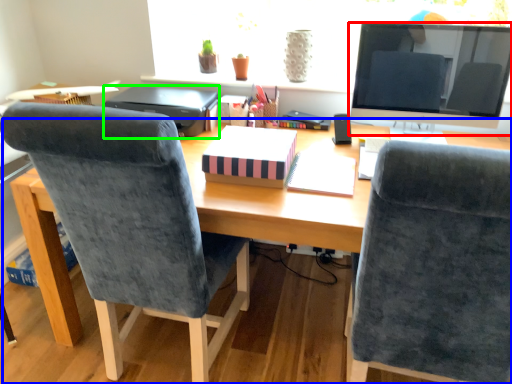
Question: Considering the real-world distances, which object is closest to television (highlighted by a red box)? desk (highlighted by a blue box) or printer (highlighted by a green box).

Choices:
 (A) desk
 (B) printer

Answer: (A)